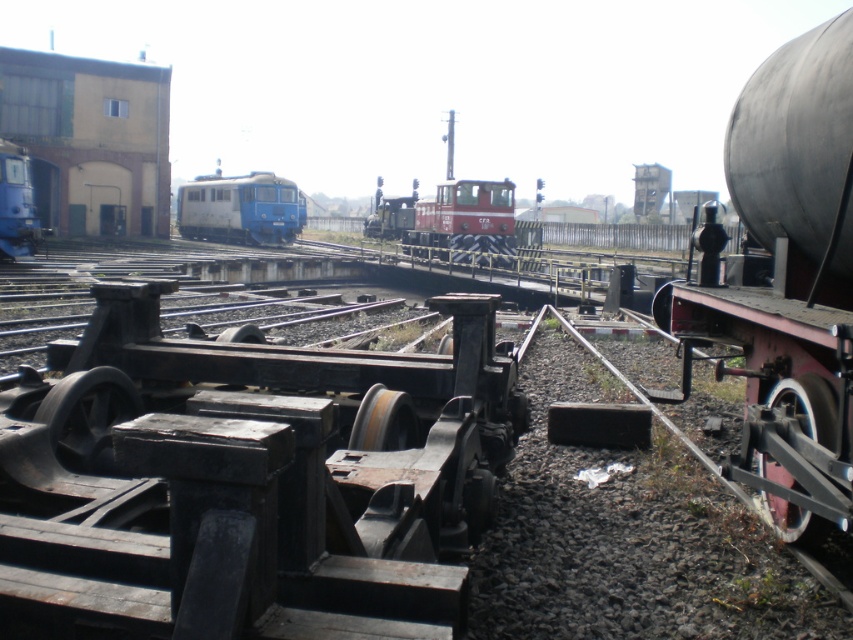
Does blue matte train at center appear on the left side of brushed metal locomotive at left?

Indeed, blue matte train at center is positioned on the left side of brushed metal locomotive at left.

Is point (207, 237) in front of point (16, 214)?

No, (207, 237) is further to viewer.

What are the coordinates of `blue matte train at center` in the screenshot? It's located at (241, 209).

Locate an element on the screen. The width and height of the screenshot is (853, 640). blue matte train at center is located at coordinates (241, 209).

Which is more to the right, red matte train at center or brushed metal locomotive at left?

red matte train at center is more to the right.

Is red matte train at center above brushed metal locomotive at left?

Indeed, red matte train at center is positioned over brushed metal locomotive at left.

What are the coordinates of `red matte train at center` in the screenshot? It's located at (451, 221).

Is point (689, 344) more distant than point (216, 198)?

No.

Is point (692, 333) positioned behind point (201, 211)?

No, it is not.

In order to click on smooth black tank car at right in this screenshot , I will do `click(786, 282)`.